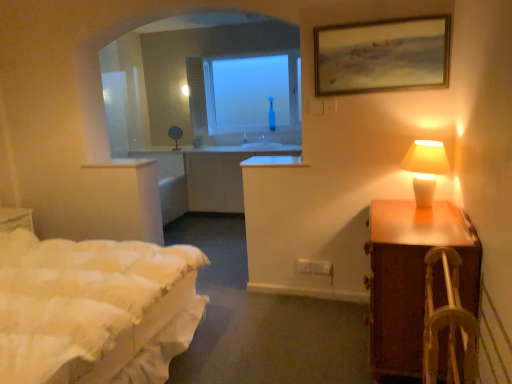
Question: Looking at the image, does white ceramic lamp at right seem bigger or smaller compared to brown wooden nightstand at right?

Choices:
 (A) big
 (B) small

Answer: (B)

Question: In the image, is white ceramic lamp at right on the left side or the right side of brown wooden nightstand at right?

Choices:
 (A) right
 (B) left

Answer: (A)

Question: Which is farther from the wooden woven armchair at right?

Choices:
 (A) wooden framed painting at upper right
 (B) transparent glass window at center
 (C) white ceramic lamp at right
 (D) white quilted bed at left
 (E) brown wooden nightstand at right

Answer: (B)

Question: Which object is the farthest from the white quilted bed at left?

Choices:
 (A) wooden framed painting at upper right
 (B) transparent glass window at center
 (C) white ceramic lamp at right
 (D) wooden woven armchair at right
 (E) brown wooden nightstand at right

Answer: (B)